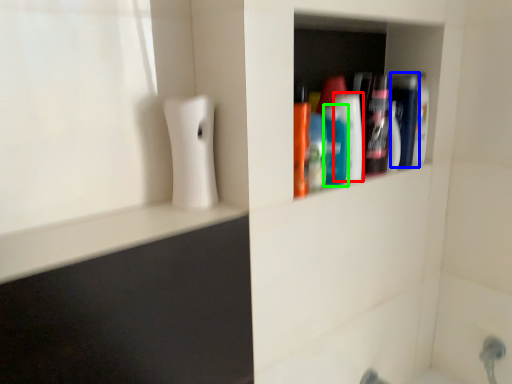
Question: Which object is positioned closest to mouthwash (highlighted by a red box)? Select from mouthwash (highlighted by a blue box) and mouthwash (highlighted by a green box).

Choices:
 (A) mouthwash
 (B) mouthwash

Answer: (B)